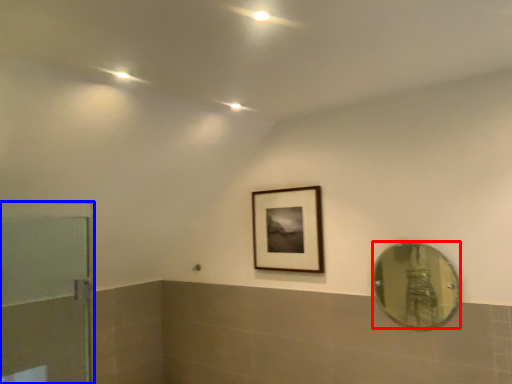
Question: Which point is further to the camera, mirror (highlighted by a red box) or door (highlighted by a blue box)?

Choices:
 (A) mirror
 (B) door

Answer: (A)